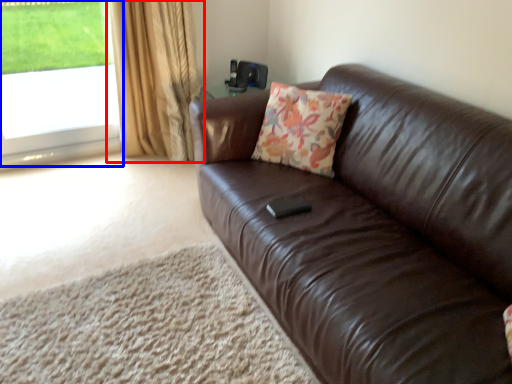
Question: Which point is further to the camera, curtain (highlighted by a red box) or window (highlighted by a blue box)?

Choices:
 (A) curtain
 (B) window

Answer: (B)